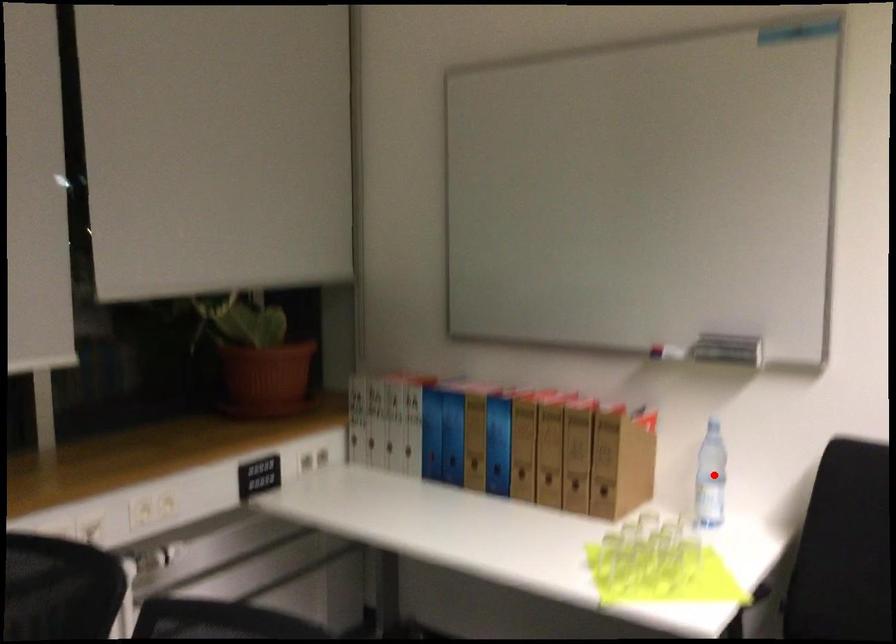
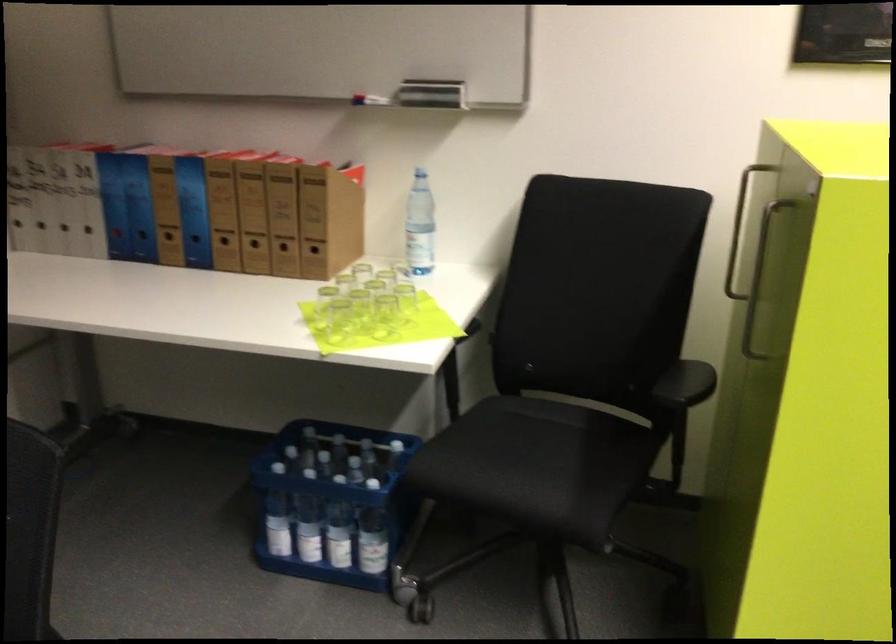
In the second image, find the point that corresponds to the highlighted location in the first image.

(419, 225)